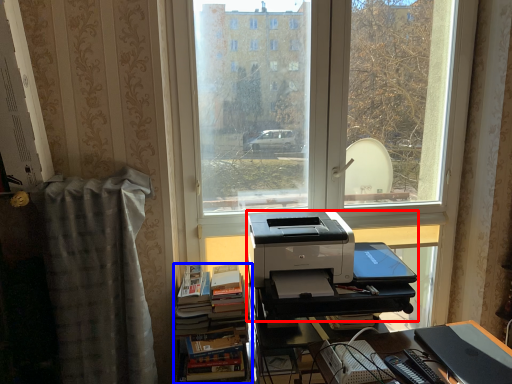
Question: Which point is closer to the camera, printer (highlighted by a red box) or book (highlighted by a blue box)?

Choices:
 (A) printer
 (B) book

Answer: (A)